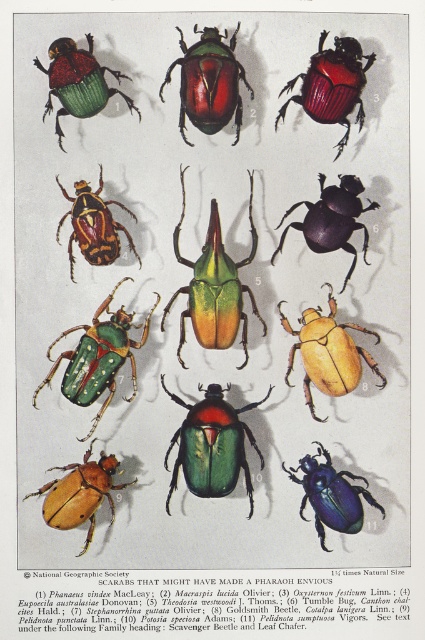
Question: Estimate the real-world distances between objects in this image. Which object is farther from the shiny metallic beetle at upper left?

Choices:
 (A) metallic green beetle at upper left
 (B) green glossy beetle at center
 (C) glossy metallic beetle at center

Answer: (A)

Question: Which is nearer to the green glossy beetle at center-left?

Choices:
 (A) matte orange beetle at lower left
 (B) shiny metallic beetle at upper left
 (C) metallic blue beetle at center
 (D) purple glossy beetle at center

Answer: (A)

Question: Does glossy metallic beetle at center appear on the left side of shiny green beetle at upper left?

Choices:
 (A) no
 (B) yes

Answer: (A)

Question: Estimate the real-world distances between objects in this image. Which object is closer to the green glossy beetle at center?

Choices:
 (A) shiny metallic beetle at upper left
 (B) purple glossy beetle at center
 (C) green metallic beetle at center

Answer: (B)

Question: Can you confirm if yellow matte beetle at center-right is positioned to the right of shiny metallic beetle at upper left?

Choices:
 (A) yes
 (B) no

Answer: (A)

Question: Observing the image, what is the correct spatial positioning of green glossy beetle at center in reference to yellow matte beetle at center-right?

Choices:
 (A) above
 (B) below

Answer: (A)